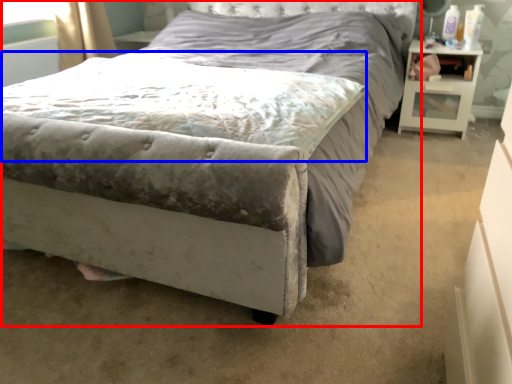
Question: Which point is closer to the camera, bed (highlighted by a red box) or mattress (highlighted by a blue box)?

Choices:
 (A) bed
 (B) mattress

Answer: (A)